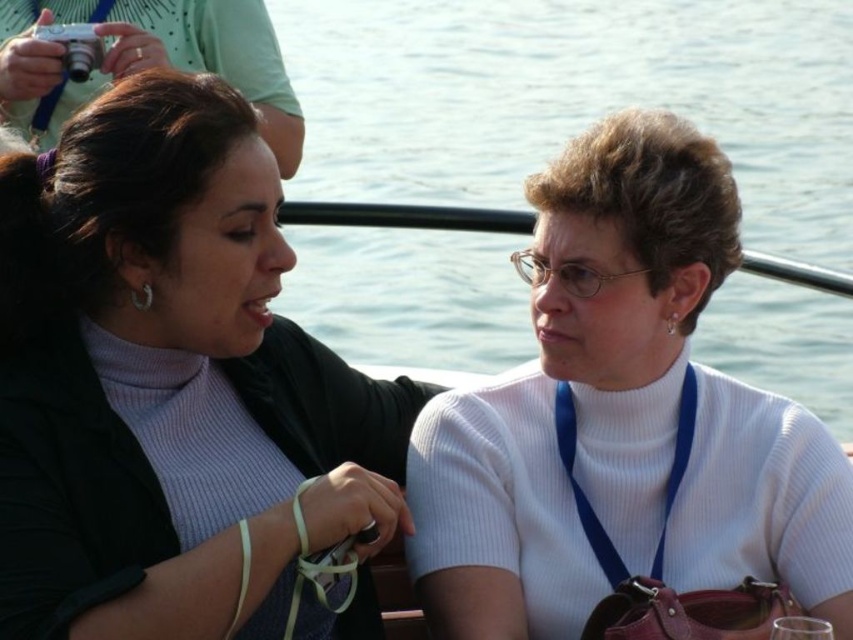
Question: Which point is farther to the camera?

Choices:
 (A) (42, 596)
 (B) (635, 42)

Answer: (B)

Question: Based on their relative distances, which object is farther from the white ribbed sweater at center?

Choices:
 (A) clear blue water at center
 (B) matte black jacket at left

Answer: (A)

Question: Estimate the real-world distances between objects in this image. Which object is farther from the white ribbed sweater at center?

Choices:
 (A) clear blue water at center
 (B) matte black jacket at left

Answer: (A)

Question: Is matte black jacket at left closer to the viewer compared to clear blue water at center?

Choices:
 (A) yes
 (B) no

Answer: (A)

Question: Can you confirm if clear blue water at center is bigger than white ribbed sweater at center?

Choices:
 (A) yes
 (B) no

Answer: (A)

Question: Does clear blue water at center have a lesser width compared to white ribbed sweater at center?

Choices:
 (A) yes
 (B) no

Answer: (B)